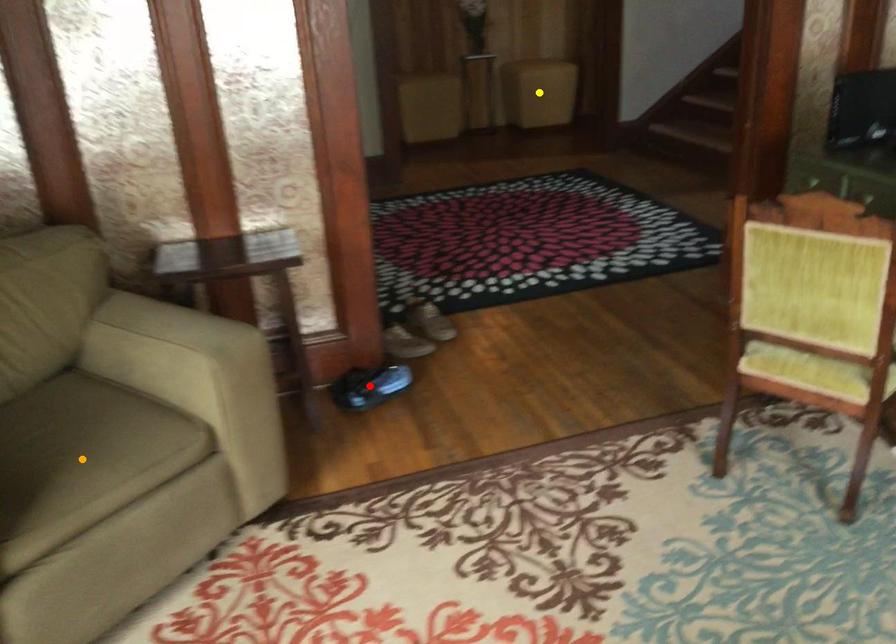
Order these from nearest to farthest:
1. orange point
2. yellow point
3. red point

1. orange point
2. red point
3. yellow point